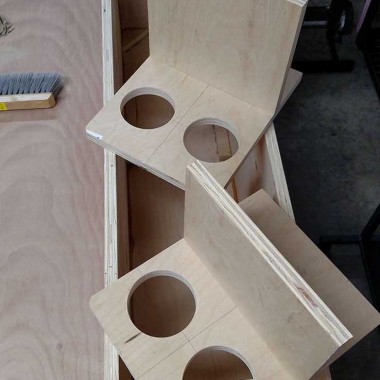
Where is `table`? The image size is (380, 380). table is located at coordinates click(67, 223).